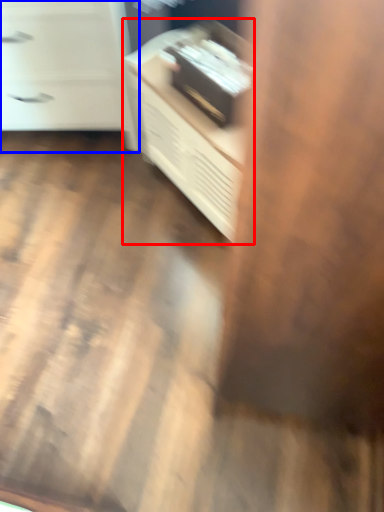
Question: Which object is closer to the camera taking this photo, furniture (highlighted by a red box) or chest of drawers (highlighted by a blue box)?

Choices:
 (A) furniture
 (B) chest of drawers

Answer: (A)